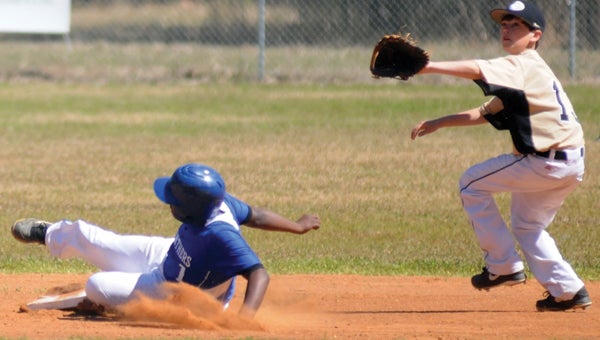
The width and height of the screenshot is (600, 340). Identify the location of shoe. (494, 287).